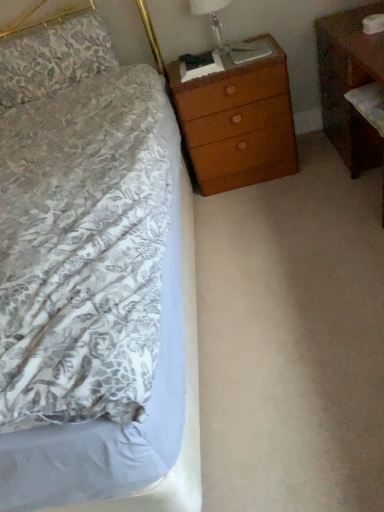
Image resolution: width=384 pixels, height=512 pixels. In order to click on free space on the front side of wooden chest of drawers at upper right in this screenshot , I will do `click(261, 199)`.